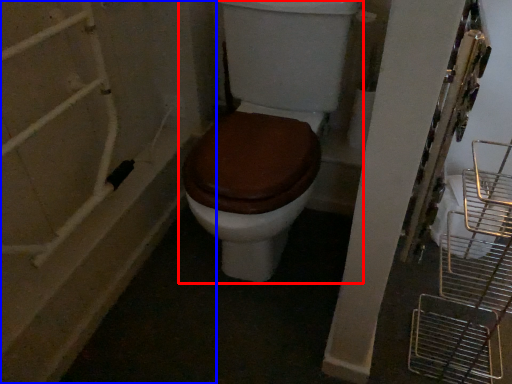
Question: Which object appears closest to the camera in this image, toilet (highlighted by a red box) or bath (highlighted by a blue box)?

Choices:
 (A) toilet
 (B) bath

Answer: (A)